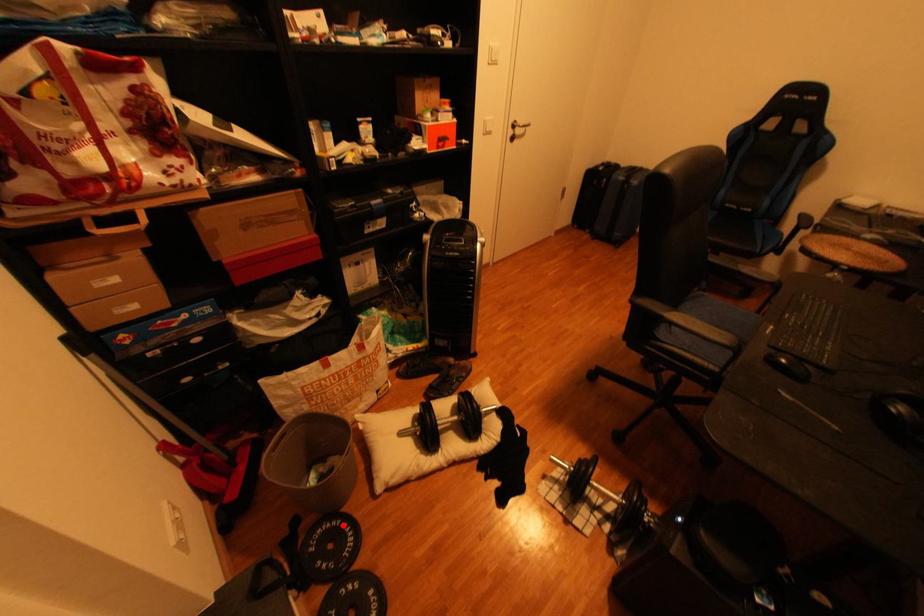
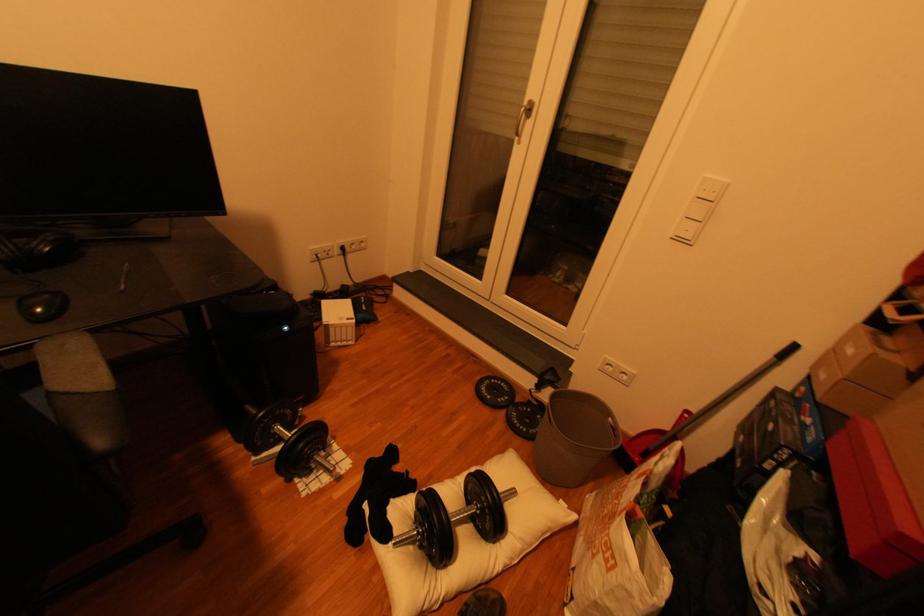
Locate, in the second image, the point that corresponds to the highlighted location in the first image.

(543, 431)